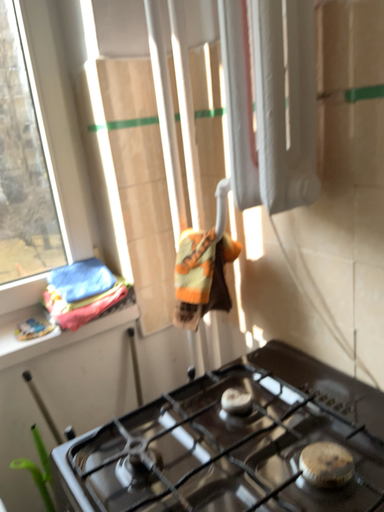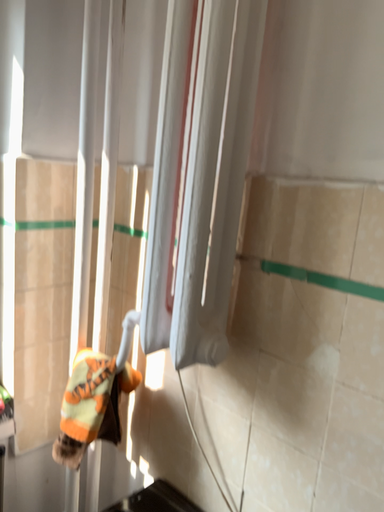
Question: Which way did the camera rotate in the video?

Choices:
 (A) rotated left
 (B) rotated right

Answer: (B)